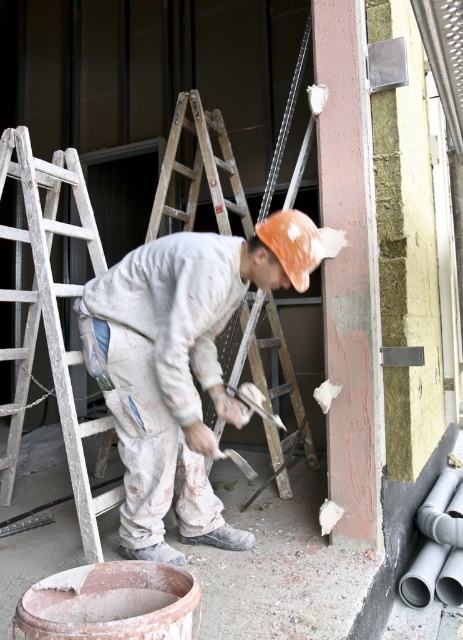
Question: Does white wooden ladder at left appear on the left side of wooden ladder at center?

Choices:
 (A) yes
 (B) no

Answer: (A)

Question: Can you confirm if white powdery cement at lower center is positioned below wooden ladder at center?

Choices:
 (A) yes
 (B) no

Answer: (A)

Question: Which object is farther from the camera taking this photo?

Choices:
 (A) white powdery cement at lower center
 (B) wooden ladder at center
 (C) white matte paint at center
 (D) white wooden ladder at left

Answer: (B)

Question: Which object appears closest to the camera in this image?

Choices:
 (A) white wooden ladder at left
 (B) white matte paint at center
 (C) white powdery cement at lower center

Answer: (C)

Question: Which of these objects is positioned farthest from the white wooden ladder at left?

Choices:
 (A) wooden ladder at center
 (B) white matte paint at center

Answer: (A)

Question: Is white matte paint at center below white powdery cement at lower center?

Choices:
 (A) no
 (B) yes

Answer: (A)